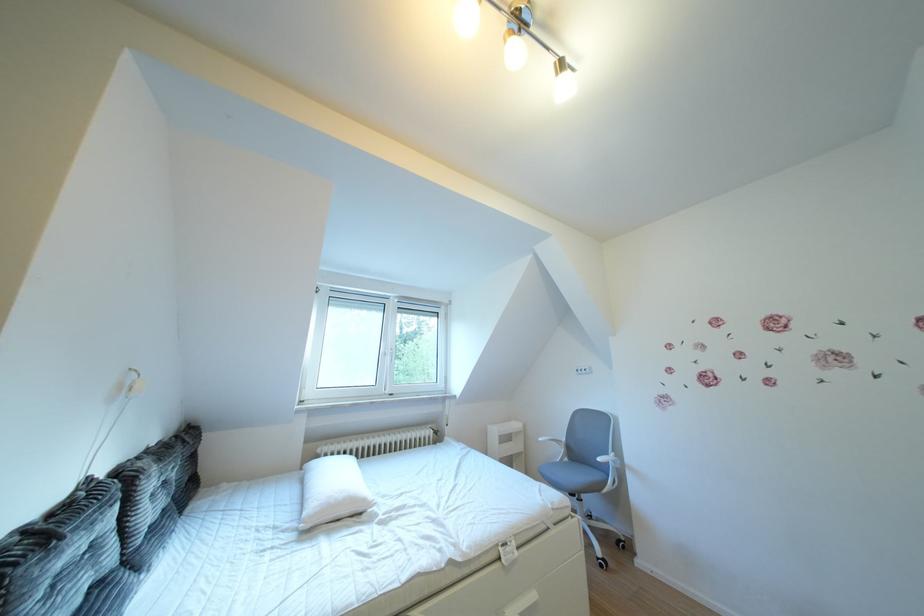
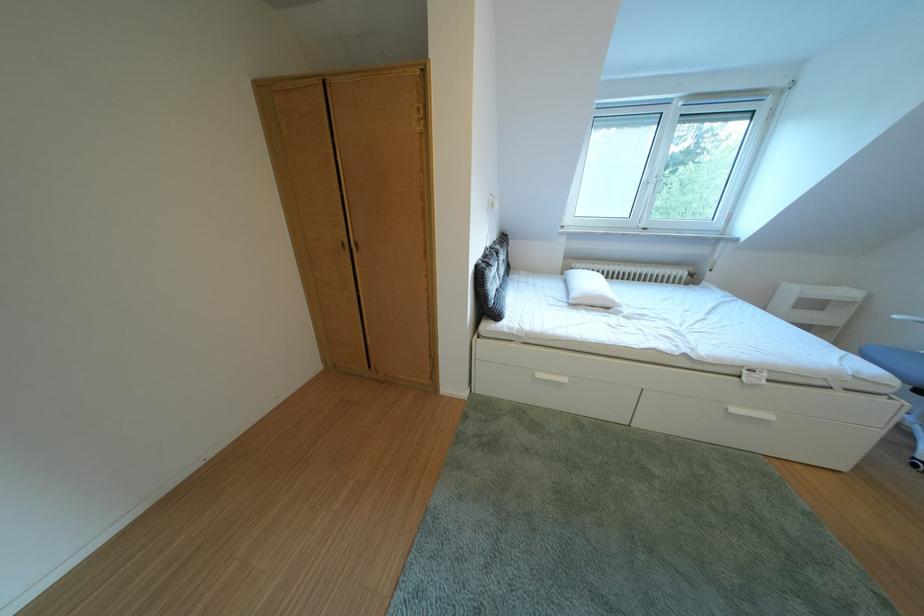
Locate, in the second image, the point that corresponds to point 130,477 in the first image.

(505, 254)